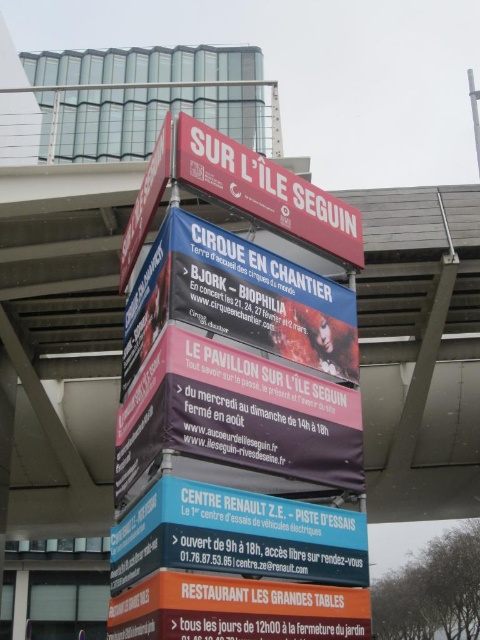
Question: Which point is farther from the camera taking this photo?

Choices:
 (A) (240, 198)
 (B) (283, 456)
 (C) (151, 204)
 (D) (358, 538)

Answer: (C)

Question: Does matte red sign at upper center have a smaller size compared to matte pink sign at center?

Choices:
 (A) no
 (B) yes

Answer: (A)

Question: Which of the following is the closest to the observer?

Choices:
 (A) orange matte signboard at lower center
 (B) white plastic sign at upper center
 (C) matte red sign at upper center

Answer: (C)

Question: Which point is closer to the camera?

Choices:
 (A) (316, 392)
 (B) (254, 518)
 (C) (286, 218)
 (D) (168, 516)

Answer: (D)

Question: From the image, what is the correct spatial relationship of orange matte signboard at lower center in relation to red matte sign at upper center?

Choices:
 (A) right
 (B) left

Answer: (B)

Question: Can you confirm if blue plastic sign at center is bigger than white plastic sign at upper center?

Choices:
 (A) no
 (B) yes

Answer: (A)